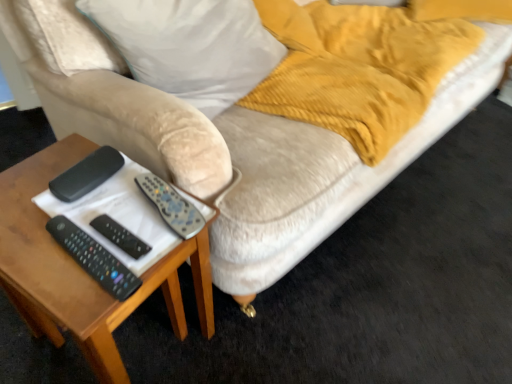
Identify the location of free space in front of black plastic remote at lower left, the first remote from the bottom. The height and width of the screenshot is (384, 512). (78, 298).